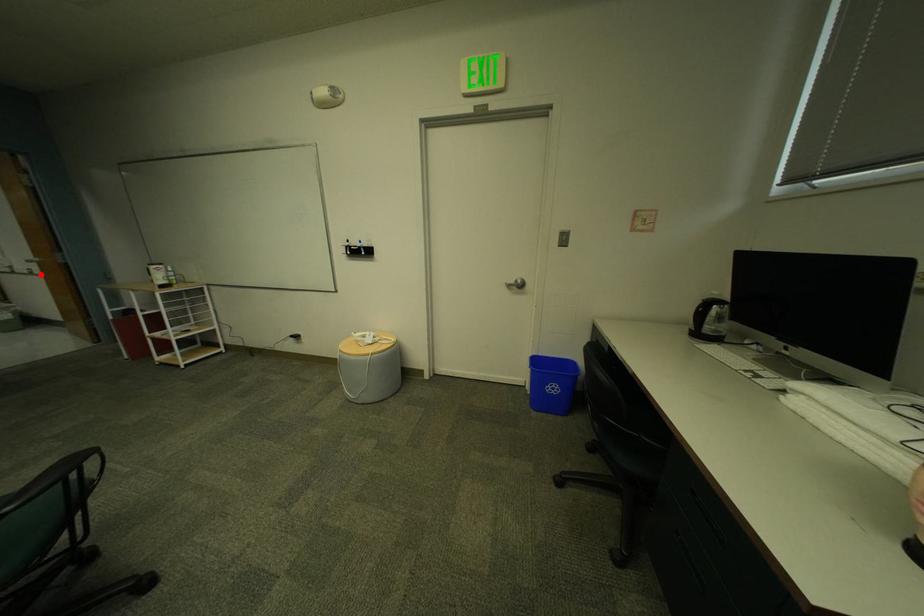
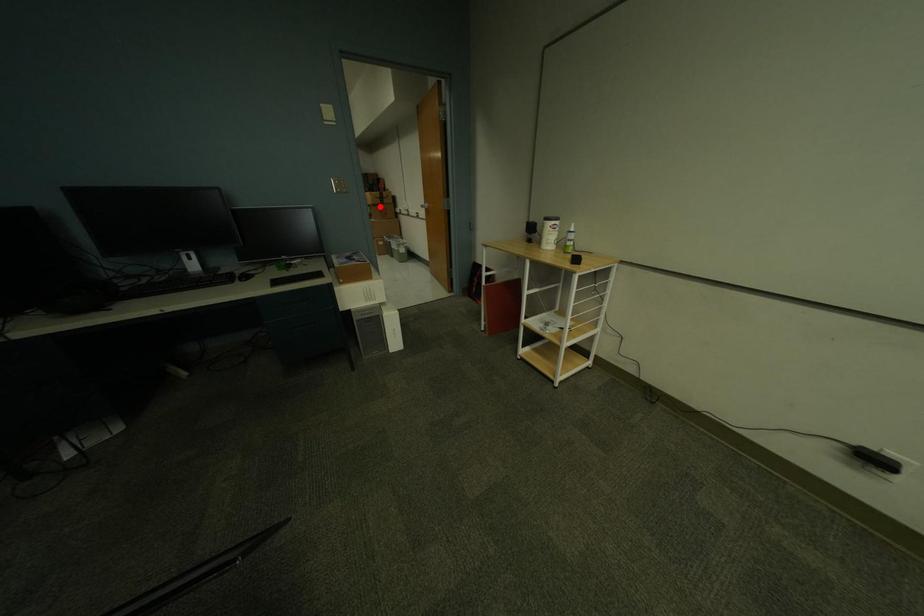
I am providing you with two images of the same scene from different viewpoints. A red point is marked on the first image and another point is marked on the second image. Is the marked point in image1 the same physical position as the marked point in image2?

No